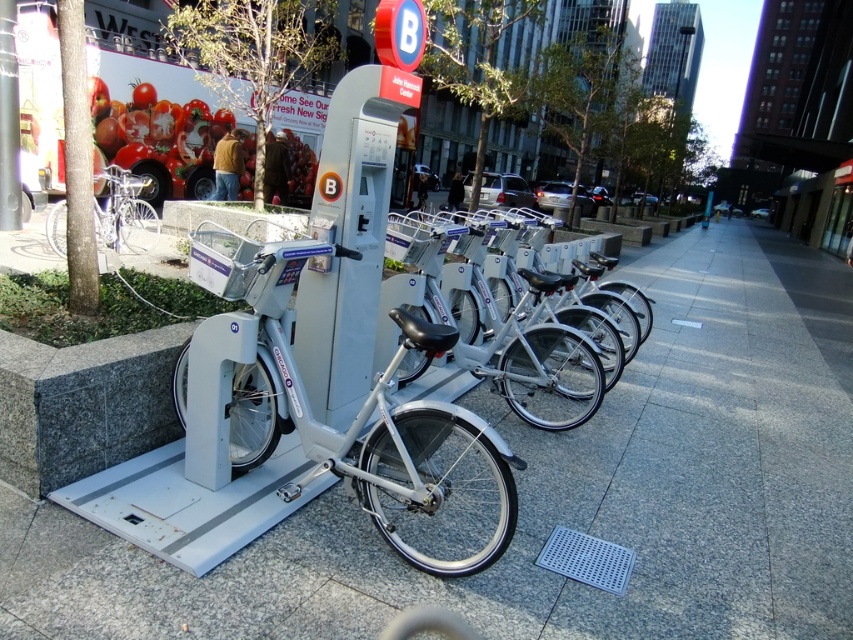
Does silver metallic pavement at center appear on the left side of silver metallic bicycle at left?

No, silver metallic pavement at center is not to the left of silver metallic bicycle at left.

Consider the image. Who is more forward, (x=677, y=364) or (x=112, y=218)?

Point (x=677, y=364) is in front.

The width and height of the screenshot is (853, 640). Identify the location of silver metallic pavement at center. (560, 492).